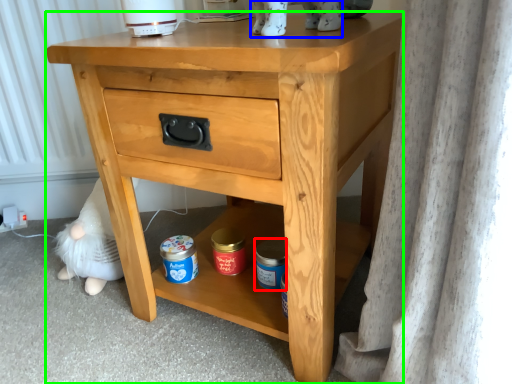
Question: Which object is positioned farthest from pottery (highlighted by a red box)? Select from animal (highlighted by a blue box) and nightstand (highlighted by a green box).

Choices:
 (A) animal
 (B) nightstand

Answer: (A)